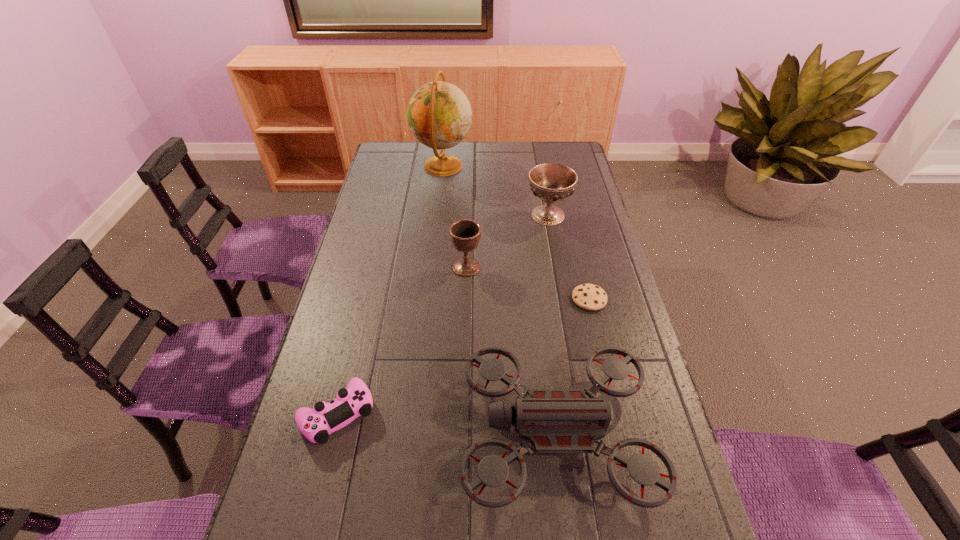
Locate an element on the screen. free space located on the right of the farthest object is located at coordinates (528, 166).

You are a GUI agent. You are given a task and a screenshot of the screen. Output one action in this format:
    pyautogui.click(x=<x>, y=<y>)
    Task: Click on the vacant space located 0.110m on the front of the right chalice
    This screenshot has width=960, height=540.
    Given the screenshot: What is the action you would take?
    pyautogui.click(x=554, y=250)

This screenshot has width=960, height=540. What are the coordinates of `free space located 0.110m on the back of the left chalice` in the screenshot? It's located at (468, 237).

At what (x,y) coordinates should I click in order to perform the action: click on blank space located 0.180m on the front-facing side of the third shortest object. Please return your answer as a coordinate pair (x, y). Looking at the image, I should click on (388, 432).

At what (x,y) coordinates should I click in order to perform the action: click on vacant space located 0.300m on the front-facing side of the third shortest object. Please return your answer as a coordinate pair (x, y). The height and width of the screenshot is (540, 960). Looking at the image, I should click on (338, 432).

The width and height of the screenshot is (960, 540). In order to click on vacant area located 0.210m on the front-facing side of the third shortest object in this screenshot , I will do `click(375, 432)`.

What are the coordinates of `free point located on the back of the control` in the screenshot? It's located at (368, 288).

Find the location of a particular element. This screenshot has width=960, height=540. blank space located 0.230m on the front of the fourth farthest object is located at coordinates (608, 379).

Find the location of a particular element. object that is at the far edge is located at coordinates (439, 114).

Where is `globe at the left edge`? Image resolution: width=960 pixels, height=540 pixels. globe at the left edge is located at coordinates (439, 114).